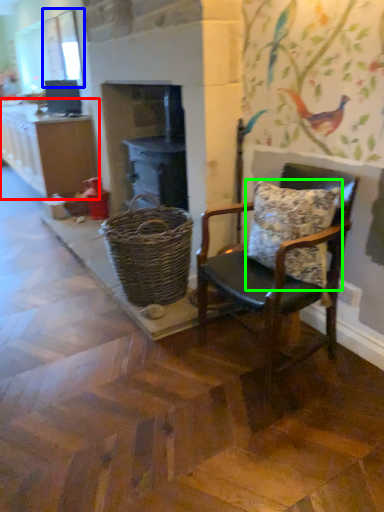
Question: Estimate the real-world distances between objects in this image. Which object is farther from cabinetry (highlighted by a red box), window screen (highlighted by a blue box) or pillow (highlighted by a green box)?

Choices:
 (A) window screen
 (B) pillow

Answer: (B)